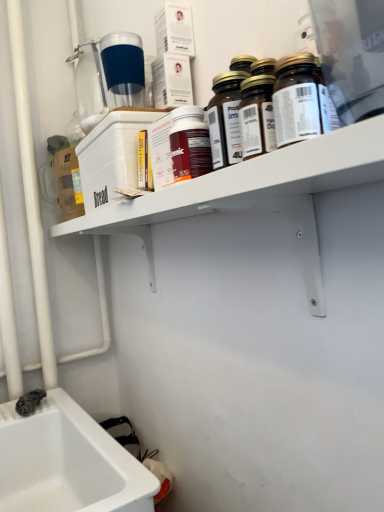
You are a GUI agent. You are given a task and a screenshot of the screen. Output one action in this format:
    pyautogui.click(x=<x>, y=<y>)
    Task: Click on the brown glass bottle at upper center, arranged as the first bottle when viewed from the front
    
    Given the screenshot: What is the action you would take?
    point(295,99)

Describe the element at coordinates (256, 195) in the screenshot. I see `white plastic shelf at upper center` at that location.

This screenshot has height=512, width=384. What do you see at coordinates (225, 119) in the screenshot?
I see `translucent glass bottles at upper right, which is the third bottle from front to back` at bounding box center [225, 119].

You are a GUI agent. You are given a task and a screenshot of the screen. Output one action in this format:
    pyautogui.click(x=<x>, y=<y>)
    Task: Click on the transparent plastic bottle at upper center, positioned as the fifth bottle in front-to-back order
    The width and height of the screenshot is (384, 512).
    Given the screenshot: What is the action you would take?
    pyautogui.click(x=124, y=68)

The height and width of the screenshot is (512, 384). Identify the location of matte plastic bottle at center, which ranks as the 2th bottle in back-to-front order. (189, 143).

The width and height of the screenshot is (384, 512). What do you see at coordinates (189, 143) in the screenshot?
I see `matte plastic bottle at center, which is the fourth bottle from front to back` at bounding box center [189, 143].

Locate an element on the screen. brown glass bottle at upper center, the fifth bottle positioned from the back is located at coordinates (295, 99).

From the image's perspective, which is below, translucent glass bottles at upper center, the second bottle in the front-to-back sequence, or white plastic shelf at upper center?

white plastic shelf at upper center is shown below in the image.

Is translucent glass bottles at upper center, which is the fourth bottle from back to front, turned away from white plastic shelf at upper center?

No, translucent glass bottles at upper center, which is the fourth bottle from back to front,'s orientation is not away from white plastic shelf at upper center.

Can you confirm if translucent glass bottles at upper center, which is the fourth bottle from back to front, is thinner than white plastic shelf at upper center?

Indeed, translucent glass bottles at upper center, which is the fourth bottle from back to front, has a lesser width compared to white plastic shelf at upper center.

Considering the sizes of objects brown glass bottle at upper center, the fifth bottle positioned from the back, and translucent glass bottles at upper right, which is the third bottle from front to back, in the image provided, who is shorter, brown glass bottle at upper center, the fifth bottle positioned from the back, or translucent glass bottles at upper right, which is the third bottle from front to back,?

Standing shorter between the two is brown glass bottle at upper center, the fifth bottle positioned from the back.

Which is more to the right, brown glass bottle at upper center, arranged as the first bottle when viewed from the front, or translucent glass bottles at upper right, which is the third bottle from front to back?

Positioned to the right is brown glass bottle at upper center, arranged as the first bottle when viewed from the front.

From the image's perspective, would you say brown glass bottle at upper center, the fifth bottle positioned from the back, is positioned over translucent glass bottles at upper right, which is the third bottle from front to back?

No.

Could you tell me if brown glass bottle at upper center, arranged as the first bottle when viewed from the front, is facing white plastic shelf at upper center?

No, brown glass bottle at upper center, arranged as the first bottle when viewed from the front, is not aimed at white plastic shelf at upper center.

Is brown glass bottle at upper center, arranged as the first bottle when viewed from the front, wider or thinner than white plastic shelf at upper center?

brown glass bottle at upper center, arranged as the first bottle when viewed from the front, is thinner than white plastic shelf at upper center.

Considering the sizes of objects brown glass bottle at upper center, the fifth bottle positioned from the back, and white plastic shelf at upper center in the image provided, who is bigger, brown glass bottle at upper center, the fifth bottle positioned from the back, or white plastic shelf at upper center?

With larger size is white plastic shelf at upper center.

Would you say brown glass bottle at upper center, the fifth bottle positioned from the back, contains white plastic shelf at upper center?

Definitely not — white plastic shelf at upper center is not inside brown glass bottle at upper center, the fifth bottle positioned from the back.

From a real-world perspective, is translucent glass bottles at upper center, the second bottle in the front-to-back sequence, above or below transparent plastic bottle at upper center, marked as the first bottle in a back-to-front arrangement?

Clearly, from a real-world perspective, translucent glass bottles at upper center, the second bottle in the front-to-back sequence, is below transparent plastic bottle at upper center, marked as the first bottle in a back-to-front arrangement.

Visually, is translucent glass bottles at upper center, the second bottle in the front-to-back sequence, positioned to the left or to the right of transparent plastic bottle at upper center, positioned as the fifth bottle in front-to-back order?

From the image, it's evident that translucent glass bottles at upper center, the second bottle in the front-to-back sequence, is to the right of transparent plastic bottle at upper center, positioned as the fifth bottle in front-to-back order.

Is transparent plastic bottle at upper center, positioned as the fifth bottle in front-to-back order, at the back of translucent glass bottles at upper center, which is the fourth bottle from back to front?

translucent glass bottles at upper center, which is the fourth bottle from back to front, is not turned away from transparent plastic bottle at upper center, positioned as the fifth bottle in front-to-back order.

From a real-world perspective, does translucent glass bottles at upper right, which is the third bottle from front to back, stand above brown glass bottle at upper center, arranged as the first bottle when viewed from the front?

Yes.

Based on the photo, is translucent glass bottles at upper right, which is the third bottle from front to back, not near brown glass bottle at upper center, arranged as the first bottle when viewed from the front?

Actually, translucent glass bottles at upper right, which is the third bottle from front to back, and brown glass bottle at upper center, arranged as the first bottle when viewed from the front, are a little close together.

From the image's perspective, would you say translucent glass bottles at upper right, which is the third bottle from front to back, is shown under brown glass bottle at upper center, arranged as the first bottle when viewed from the front?

No.

From the image's perspective, starting from the brown glass bottle at upper center, the fifth bottle positioned from the back, which bottle is the 2nd one above? Please provide its 2D coordinates.

[(225, 119)]

From the image's perspective, which is below, transparent plastic bottle at upper center, positioned as the fifth bottle in front-to-back order, or translucent glass bottles at upper center, the second bottle in the front-to-back sequence?

translucent glass bottles at upper center, the second bottle in the front-to-back sequence, appears lower in the image.

Is translucent glass bottles at upper center, which is the fourth bottle from back to front, inside transparent plastic bottle at upper center, marked as the first bottle in a back-to-front arrangement?

Actually, translucent glass bottles at upper center, which is the fourth bottle from back to front, is outside transparent plastic bottle at upper center, marked as the first bottle in a back-to-front arrangement.

Can you confirm if transparent plastic bottle at upper center, positioned as the fifth bottle in front-to-back order, is positioned to the right of translucent glass bottles at upper center, which is the fourth bottle from back to front?

No.

Image resolution: width=384 pixels, height=512 pixels. What are the coordinates of `bottle that is the 3rd one when counting backward from the translucent glass bottles at upper center, which is the fourth bottle from back to front` in the screenshot? It's located at (124, 68).

Is transparent plastic bottle at upper center, marked as the first bottle in a back-to-front arrangement, wider or thinner than matte plastic bottle at center, which is the fourth bottle from front to back?

Considering their sizes, transparent plastic bottle at upper center, marked as the first bottle in a back-to-front arrangement, looks broader than matte plastic bottle at center, which is the fourth bottle from front to back.

From a real-world perspective, is transparent plastic bottle at upper center, positioned as the fifth bottle in front-to-back order, above or below matte plastic bottle at center, which ranks as the 2th bottle in back-to-front order?

From a real-world perspective, transparent plastic bottle at upper center, positioned as the fifth bottle in front-to-back order, is physically above matte plastic bottle at center, which ranks as the 2th bottle in back-to-front order.

From the image's perspective, is transparent plastic bottle at upper center, marked as the first bottle in a back-to-front arrangement, positioned above or below matte plastic bottle at center, which ranks as the 2th bottle in back-to-front order?

Based on their image positions, transparent plastic bottle at upper center, marked as the first bottle in a back-to-front arrangement, is located above matte plastic bottle at center, which ranks as the 2th bottle in back-to-front order.

Does transparent plastic bottle at upper center, positioned as the fifth bottle in front-to-back order, appear on the right side of matte plastic bottle at center, which is the fourth bottle from front to back?

Incorrect, transparent plastic bottle at upper center, positioned as the fifth bottle in front-to-back order, is not on the right side of matte plastic bottle at center, which is the fourth bottle from front to back.

From a real-world perspective, starting from the white plastic shelf at upper center, which bottle is the 1st one vertically above it? Please provide its 2D coordinates.

[(257, 116)]

From the image's perspective, which bottle is the 2nd one below the translucent glass bottles at upper right, which ranks as the 3th bottle in back-to-front order? Please provide its 2D coordinates.

[(295, 99)]

Which object lies nearer to the anchor point transparent plastic bottle at upper center, positioned as the fifth bottle in front-to-back order, white plastic shelf at upper center or matte plastic bottle at center, which is the fourth bottle from front to back?

matte plastic bottle at center, which is the fourth bottle from front to back, is closer to transparent plastic bottle at upper center, positioned as the fifth bottle in front-to-back order.

Which object lies nearer to the anchor point white plastic shelf at upper center, translucent glass bottles at upper center, which is the fourth bottle from back to front, or translucent glass bottles at upper right, which ranks as the 3th bottle in back-to-front order?

The object closer to white plastic shelf at upper center is translucent glass bottles at upper right, which ranks as the 3th bottle in back-to-front order.

Based on their spatial positions, is translucent glass bottles at upper center, which is the fourth bottle from back to front, or translucent glass bottles at upper right, which is the third bottle from front to back, closer to transparent plastic bottle at upper center, marked as the first bottle in a back-to-front arrangement?

The object closer to transparent plastic bottle at upper center, marked as the first bottle in a back-to-front arrangement, is translucent glass bottles at upper right, which is the third bottle from front to back.

Looking at the image, which one is located further to translucent glass bottles at upper right, which ranks as the 3th bottle in back-to-front order, brown glass bottle at upper center, the fifth bottle positioned from the back, or white plastic shelf at upper center?

white plastic shelf at upper center lies further to translucent glass bottles at upper right, which ranks as the 3th bottle in back-to-front order, than the other object.

When comparing their distances from translucent glass bottles at upper center, which is the fourth bottle from back to front, does translucent glass bottles at upper right, which is the third bottle from front to back, or transparent plastic bottle at upper center, positioned as the fifth bottle in front-to-back order, seem further?

transparent plastic bottle at upper center, positioned as the fifth bottle in front-to-back order, is positioned further to the anchor translucent glass bottles at upper center, which is the fourth bottle from back to front.

Considering their positions, is brown glass bottle at upper center, arranged as the first bottle when viewed from the front, positioned closer to translucent glass bottles at upper center, the second bottle in the front-to-back sequence, than translucent glass bottles at upper right, which is the third bottle from front to back?

Among the two, brown glass bottle at upper center, arranged as the first bottle when viewed from the front, is located nearer to translucent glass bottles at upper center, the second bottle in the front-to-back sequence.

When comparing their distances from translucent glass bottles at upper center, which is the fourth bottle from back to front, does white plastic shelf at upper center or transparent plastic bottle at upper center, positioned as the fifth bottle in front-to-back order, seem closer?

white plastic shelf at upper center is closer to translucent glass bottles at upper center, which is the fourth bottle from back to front.

Estimate the real-world distances between objects in this image. Which object is further from translucent glass bottles at upper center, the second bottle in the front-to-back sequence, matte plastic bottle at center, which ranks as the 2th bottle in back-to-front order, or white plastic shelf at upper center?

white plastic shelf at upper center.

What are the coordinates of `bottle between brown glass bottle at upper center, arranged as the first bottle when viewed from the front, and translucent glass bottles at upper right, which is the third bottle from front to back, in the front-back direction` in the screenshot? It's located at (257, 116).

You are a GUI agent. You are given a task and a screenshot of the screen. Output one action in this format:
    pyautogui.click(x=<x>, y=<y>)
    Task: Click on the bottle positioned between translucent glass bottles at upper right, which ranks as the 3th bottle in back-to-front order, and transparent plastic bottle at upper center, positioned as the fifth bottle in front-to-back order, from near to far
    
    Given the screenshot: What is the action you would take?
    189,143

Image resolution: width=384 pixels, height=512 pixels. Find the location of `bottle between translucent glass bottles at upper center, the second bottle in the front-to-back sequence, and matte plastic bottle at center, which ranks as the 2th bottle in back-to-front order, along the z-axis`. bottle between translucent glass bottles at upper center, the second bottle in the front-to-back sequence, and matte plastic bottle at center, which ranks as the 2th bottle in back-to-front order, along the z-axis is located at coordinates (225, 119).